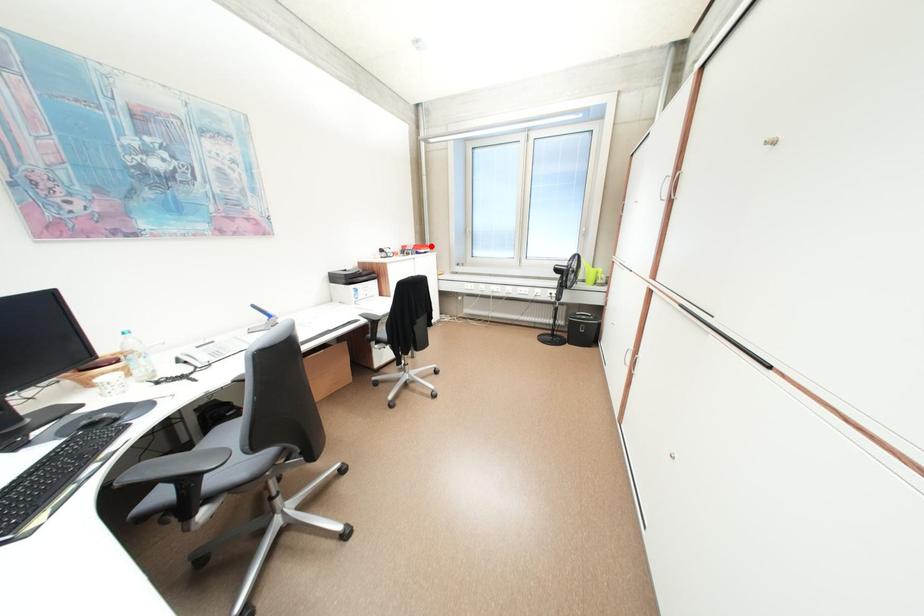
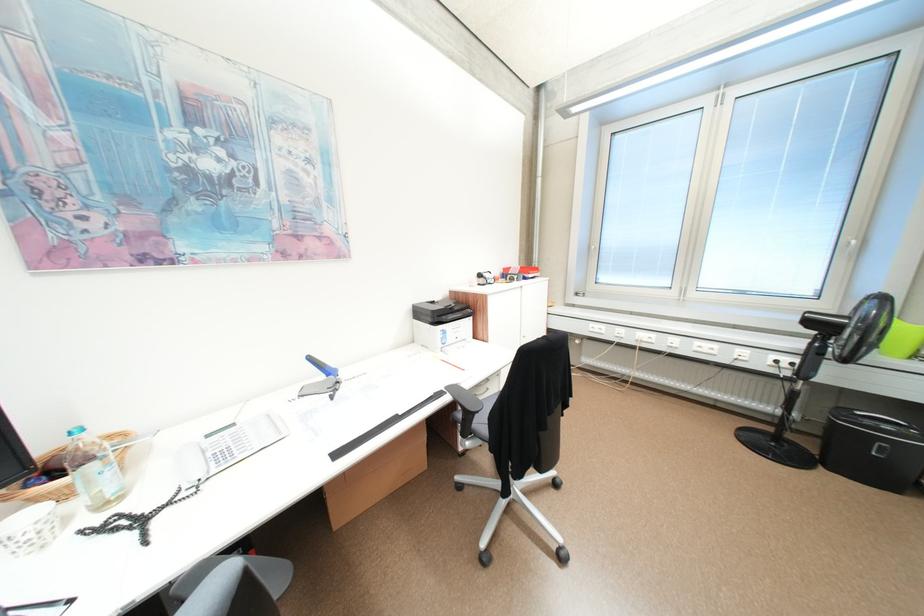
Question: A red point is marked in image1. In image2, is the corresponding 3D point closer to the camera or farther? Reply with the corresponding letter.

Choices:
 (A) The corresponding 3D point is closer.
 (B) The corresponding 3D point is farther.

Answer: (B)